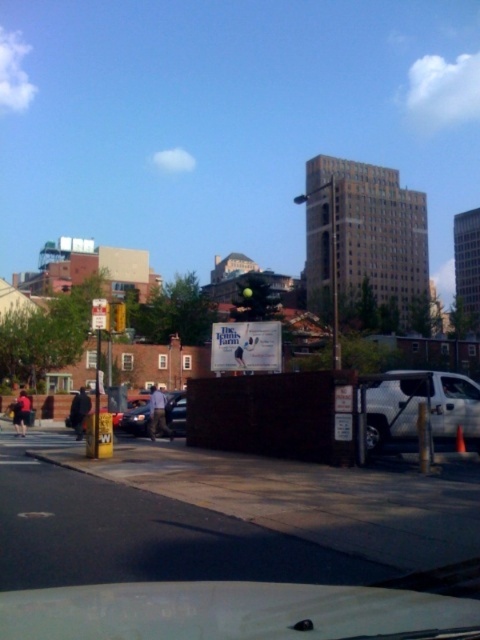
Question: Which of these objects is positioned farthest from the black matte jacket at lower left?

Choices:
 (A) white matte truck at right
 (B) transparent glass windshield at center
 (C) yellow plastic traffic light at upper left
 (D) dark blue jeans at lower left

Answer: (A)

Question: Can you confirm if black matte jacket at lower left is bigger than yellow plastic traffic light at upper left?

Choices:
 (A) no
 (B) yes

Answer: (B)

Question: Is shiny silver sedan at center above black matte jacket at lower left?

Choices:
 (A) no
 (B) yes

Answer: (B)

Question: Is gray fabric shirt at center positioned behind yellow plastic traffic light at upper left?

Choices:
 (A) yes
 (B) no

Answer: (A)

Question: Estimate the real-world distances between objects in this image. Which object is farther from the white matte truck at right?

Choices:
 (A) gray fabric shirt at center
 (B) yellow plastic traffic light at upper left

Answer: (A)

Question: Which of the following is the farthest from the observer?

Choices:
 (A) click(81, 436)
 (B) click(23, 390)
 (C) click(162, 400)

Answer: (B)